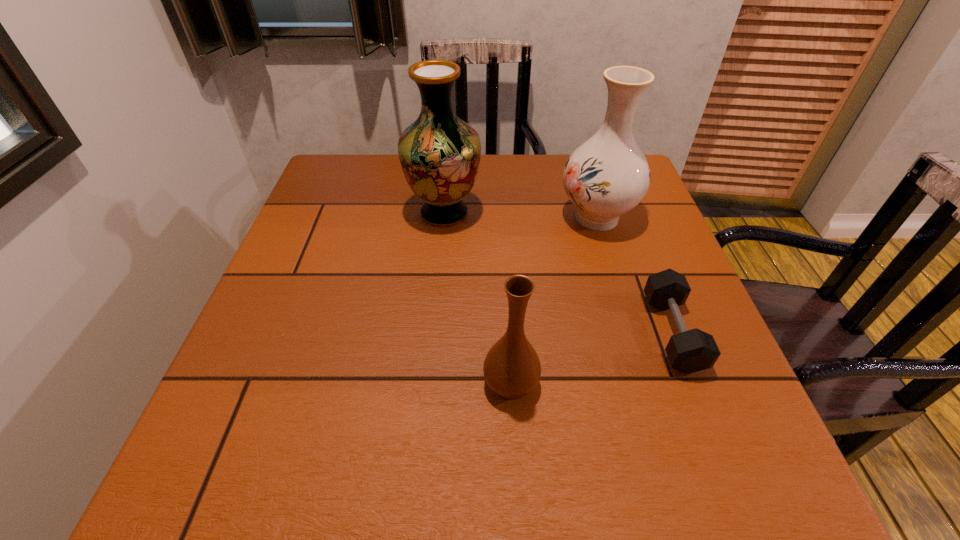
This screenshot has height=540, width=960. Find the location of `unoccupied area between the rightmost vase and the leftmost vase`. unoccupied area between the rightmost vase and the leftmost vase is located at coordinates (520, 215).

The height and width of the screenshot is (540, 960). Identify the location of free space between the rightmost vase and the leftmost object. (520, 215).

Where is `empty space between the shortest vase and the dumbbell`? empty space between the shortest vase and the dumbbell is located at coordinates (591, 358).

You are a GUI agent. You are given a task and a screenshot of the screen. Output one action in this format:
    pyautogui.click(x=<x>, y=<y>)
    Task: Click on the free space between the dumbbell and the leftmost vase
    This screenshot has width=960, height=540.
    Given the screenshot: What is the action you would take?
    pyautogui.click(x=558, y=273)

Locate an element on the screen. The image size is (960, 540). free space between the rightmost vase and the leftmost object is located at coordinates pos(520,215).

Locate an element on the screen. free point between the shortest vase and the leftmost object is located at coordinates (477, 298).

Where is `free space that is in between the leftmost object and the rightmost vase`? free space that is in between the leftmost object and the rightmost vase is located at coordinates (520, 215).

The image size is (960, 540). Identify the location of object that is the third closest to the rightmost vase. (512, 369).

What are the coordinates of `object that is the second closest one to the nearest vase` in the screenshot? It's located at coord(608,175).

The width and height of the screenshot is (960, 540). Find the location of `vase that is the nearest to the second object from left to right`. vase that is the nearest to the second object from left to right is located at coordinates (608, 175).